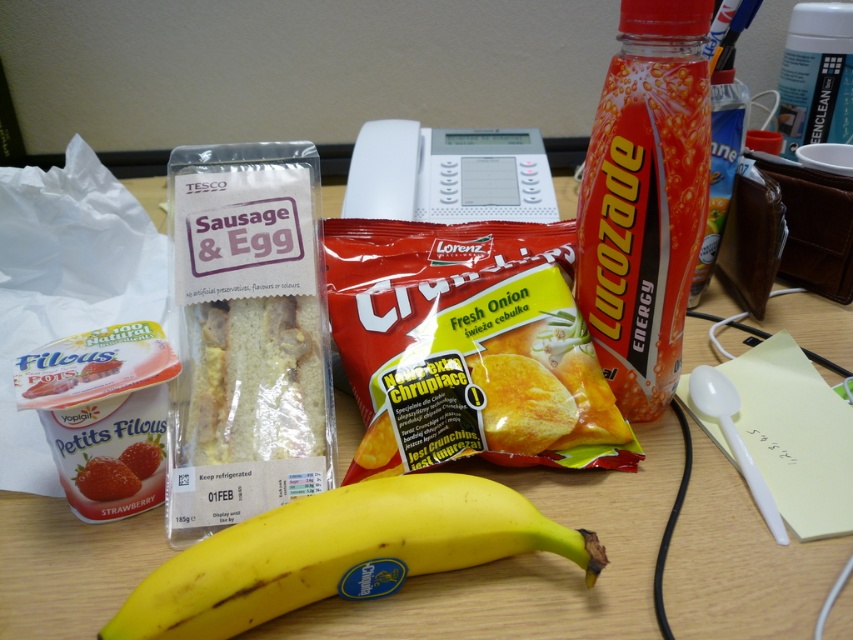
Based on the photo, you are organizing snacks on a desk and need to place the yellow crunchy chips at center and the yellow matte banana at center. If the minimum distance required between items is 5 inches for easy access, will these two items meet the requirement?

The yellow crunchy chips at center is 4.99 inches away from the yellow matte banana at center, which is just below the 5 inches requirement. Therefore, they do not meet the minimum distance requirement for easy access.

You are a delivery person who needs to place a new item on the desk. The new item is a small box that requires 4 inches of space. You see the yellow crunchy chips at center and the orange glossy lucozade energy drink at upper right. Can you fit the box between them?

The yellow crunchy chips at center and the orange glossy lucozade energy drink at upper right are 3.61 inches apart from each other. Since the required space is 4 inches, which is wider than the available space between them, the box cannot be placed between them.

You are a food delivery person who needs to stack these items in a box. The yellow crunchy chips at center and the yellow matte banana at center are both in the center area. Which item should you place first to ensure the banana stays fresh?

You should place the yellow crunchy chips at center first because it is above the yellow matte banana at center, meaning the banana is lower and needs to be at the bottom to stay fresh.